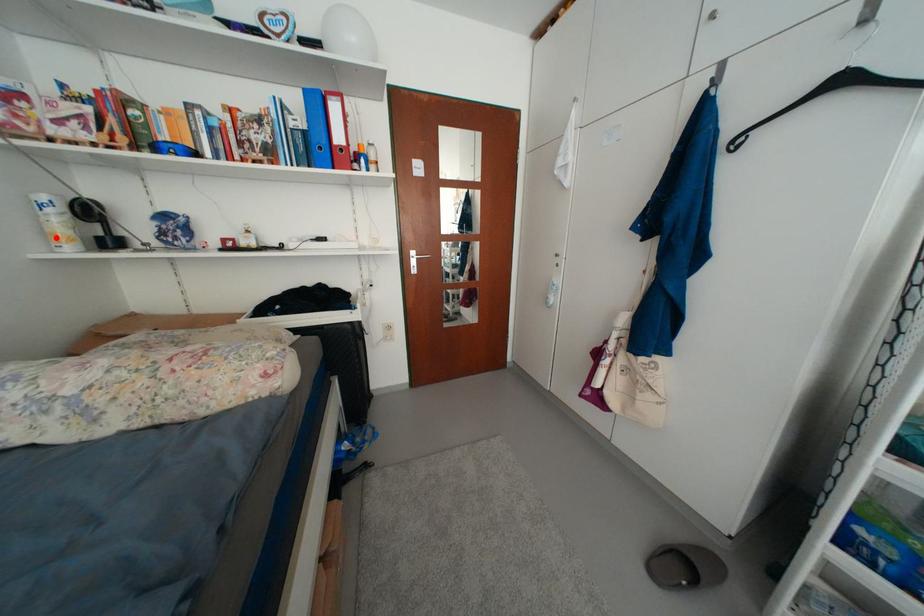
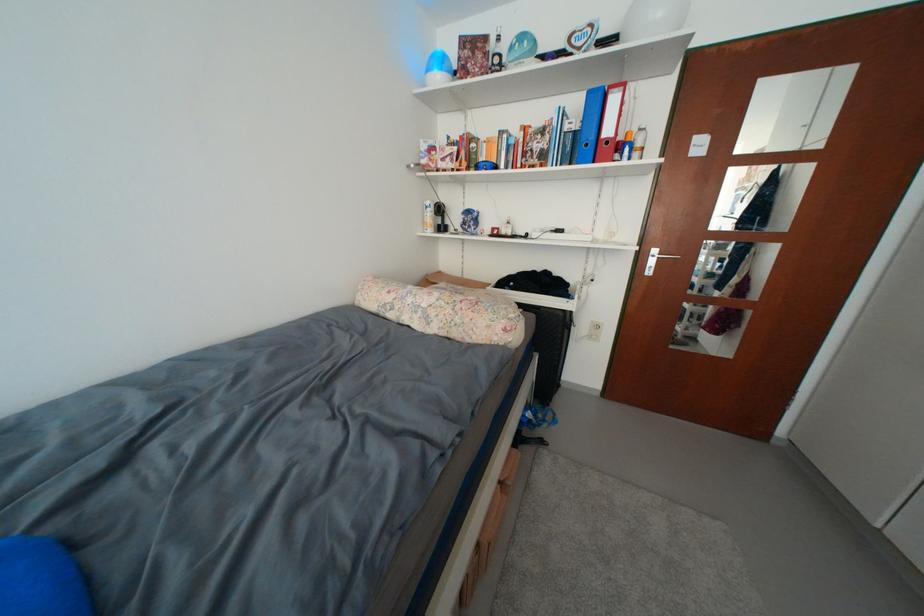
The point at the highlighted location is marked in the first image. Where is the corresponding point in the second image?

(432, 225)